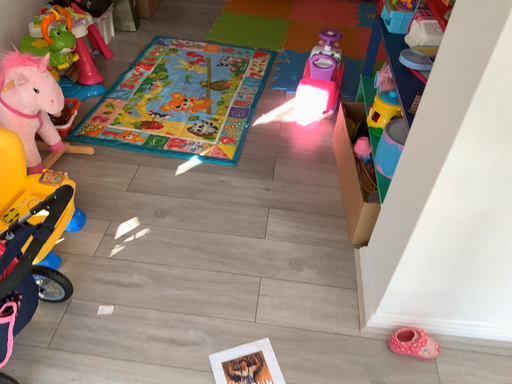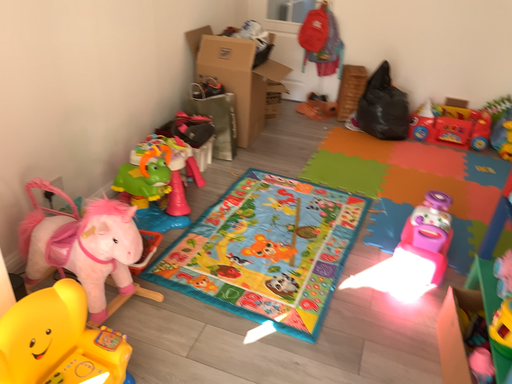
Question: How did the camera likely rotate when shooting the video?

Choices:
 (A) rotated upward
 (B) rotated downward

Answer: (A)